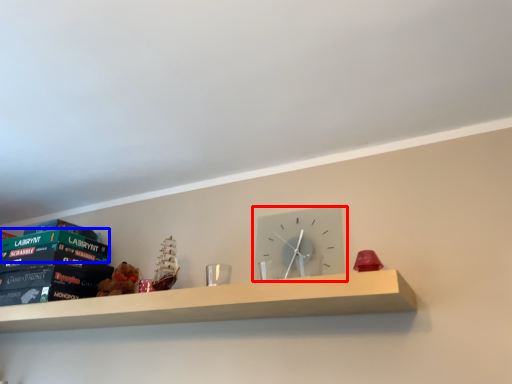
Question: Which of the following is the farthest to the observer, wall clock (highlighted by a red box) or paperback book (highlighted by a blue box)?

Choices:
 (A) wall clock
 (B) paperback book

Answer: (B)